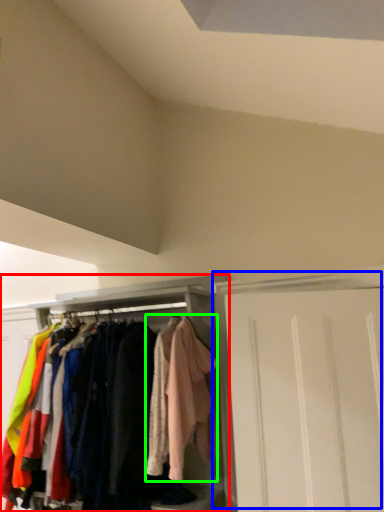
Question: Estimate the real-world distances between objects in this image. Which object is farther from cabinetry (highlighted by a red box), door (highlighted by a blue box) or clothing (highlighted by a green box)?

Choices:
 (A) door
 (B) clothing

Answer: (A)